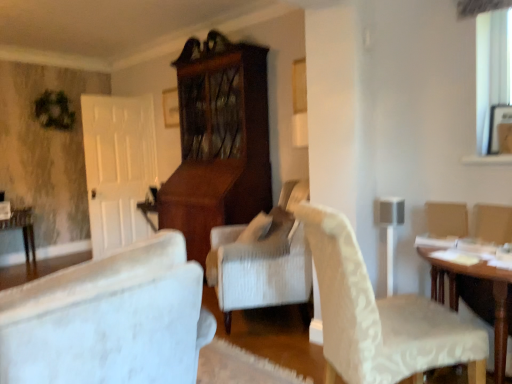
Question: From the image's perspective, is white textured chair at center-right above or below wooden table at right, the first table when ordered from front to back?

Choices:
 (A) above
 (B) below

Answer: (A)

Question: Which is correct: white textured chair at center-right is inside wooden table at right, which is counted as the first table, starting from the right, or outside of it?

Choices:
 (A) inside
 (B) outside

Answer: (B)

Question: Estimate the real-world distances between objects in this image. Which object is farther from the wooden table at right, which is counted as the first table, starting from the right?

Choices:
 (A) white textured chair at center-right
 (B) wooden table at lower left, placed as the 1th table when sorted from back to front

Answer: (B)

Question: Estimate the real-world distances between objects in this image. Which object is farther from the wooden table at lower left, marked as the 2th table in a front-to-back arrangement?

Choices:
 (A) wooden table at right, acting as the second table starting from the back
 (B) white textured chair at center-right

Answer: (A)